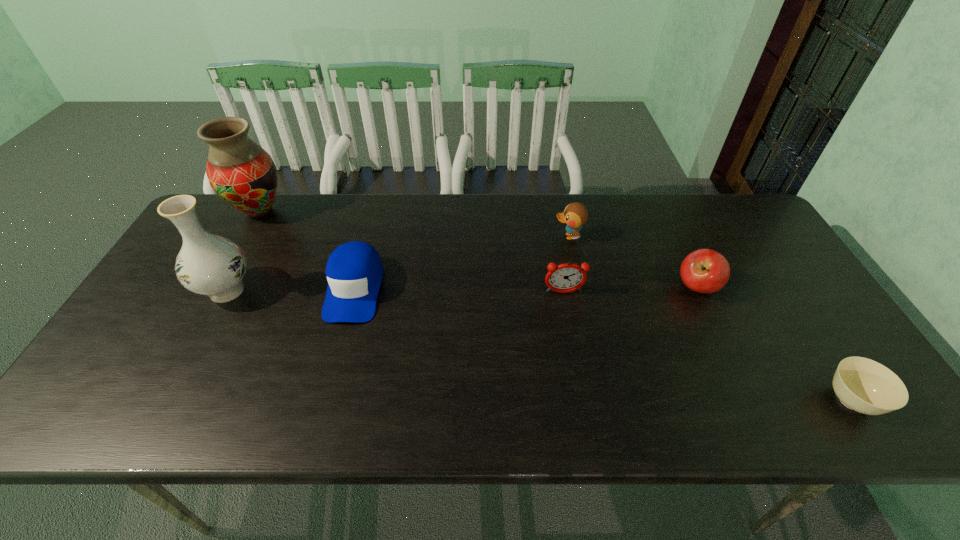
At what (x,y) coordinates should I click in order to perform the action: click on object situated at the right edge. Please return your answer as a coordinate pair (x, y). This screenshot has height=540, width=960. Looking at the image, I should click on (861, 384).

Where is `object that is positioned at the far left corner`? object that is positioned at the far left corner is located at coordinates (243, 174).

Locate an element on the screen. object located at the near right corner is located at coordinates (861, 384).

The width and height of the screenshot is (960, 540). Find the location of `vacant space at the far edge`. vacant space at the far edge is located at coordinates (668, 234).

Locate an element on the screen. The height and width of the screenshot is (540, 960). free location at the near edge of the desktop is located at coordinates (293, 407).

Where is `vacant space at the left edge of the desktop`? vacant space at the left edge of the desktop is located at coordinates (192, 322).

Find the location of a particular element. This screenshot has height=540, width=960. vacant space at the right edge of the desktop is located at coordinates (800, 295).

Where is `free spot at the far left corner of the desktop`? The width and height of the screenshot is (960, 540). free spot at the far left corner of the desktop is located at coordinates (229, 208).

Locate an element on the screen. free spot at the far right corner of the desktop is located at coordinates (769, 238).

This screenshot has height=540, width=960. Find the location of `vacant area between the farther vase and the alarm clock`. vacant area between the farther vase and the alarm clock is located at coordinates (411, 252).